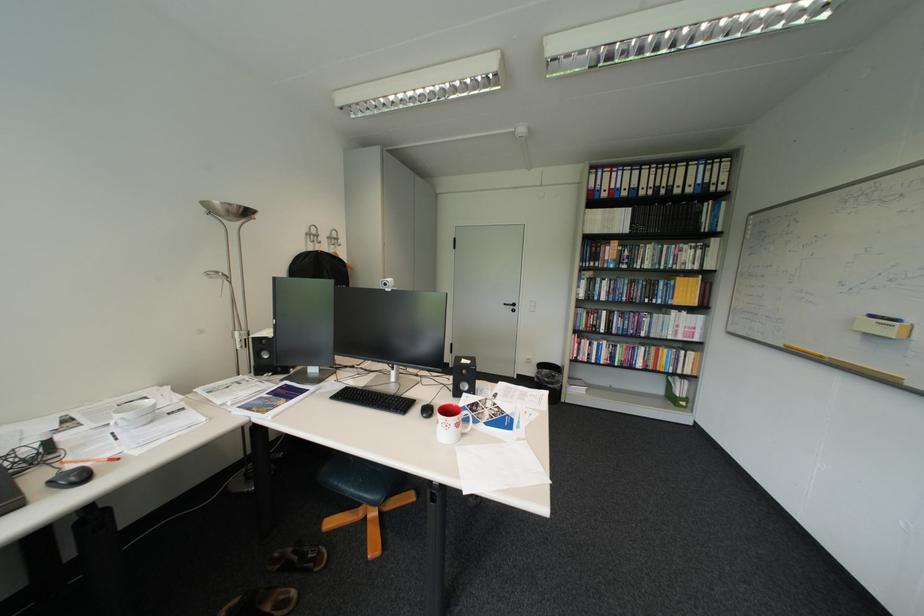
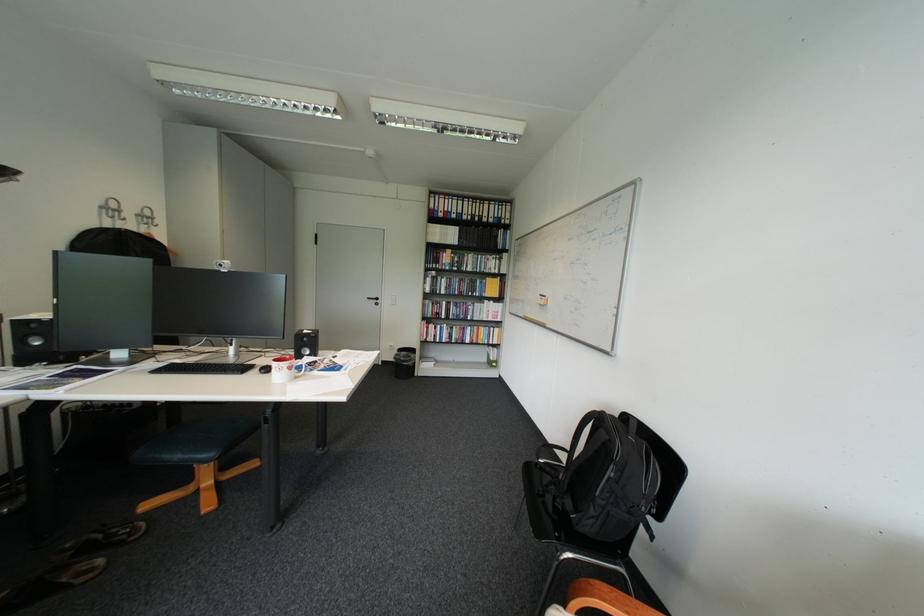
Find the pixel in the second image that matches pixel 529 376 in the first image.

(395, 362)